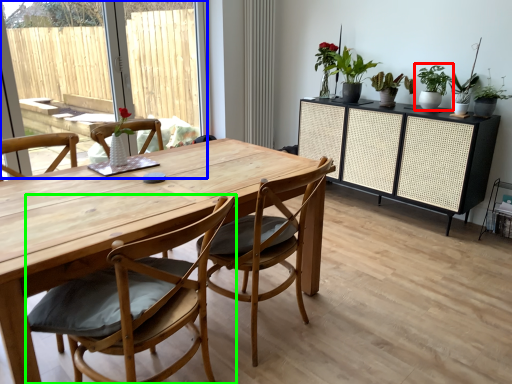
Question: Based on their relative distances, which object is nearer to houseplant (highlighted by a red box)? Choose from window screen (highlighted by a blue box) and chair (highlighted by a green box).

Choices:
 (A) window screen
 (B) chair

Answer: (B)